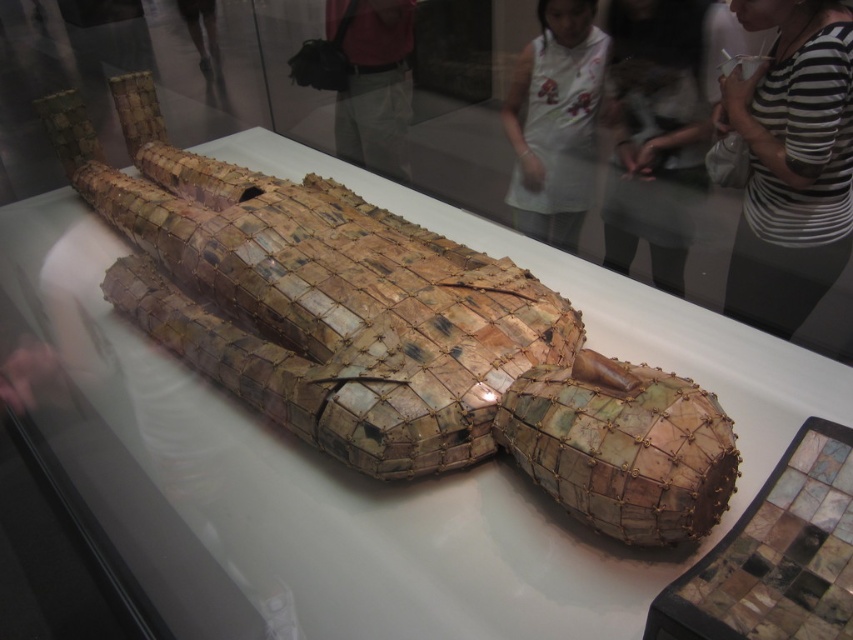
Question: Which point is farther to the camera?

Choices:
 (A) (563, 180)
 (B) (805, 177)

Answer: (A)

Question: Is white apron at upper center behind white fabric at upper center?

Choices:
 (A) no
 (B) yes

Answer: (A)

Question: Does shiny metallic mosaic crocodile at center come behind matte pink shirt at upper center?

Choices:
 (A) yes
 (B) no

Answer: (B)

Question: Which object is positioned closest to the white fabric at upper center?

Choices:
 (A) shiny metallic mosaic crocodile at center
 (B) white apron at upper center

Answer: (B)

Question: Which object is the farthest from the white fabric at upper center?

Choices:
 (A) striped fabric shirt at upper right
 (B) matte pink shirt at upper center

Answer: (B)

Question: Is white apron at upper center to the right of matte pink shirt at upper center from the viewer's perspective?

Choices:
 (A) yes
 (B) no

Answer: (A)